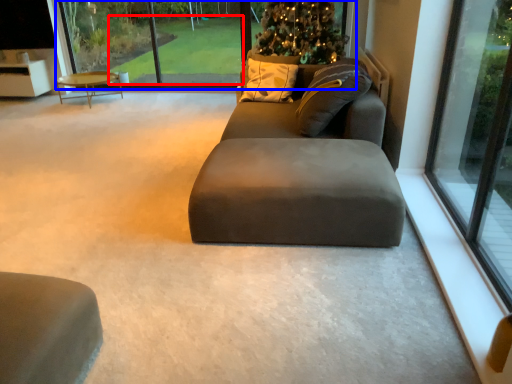
Question: Which object appears closest to the camera in this image, golf course (highlighted by a red box) or glass window (highlighted by a blue box)?

Choices:
 (A) golf course
 (B) glass window

Answer: (B)